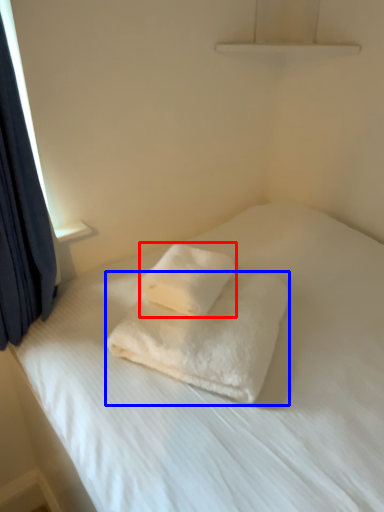
Question: Which point is further to the camera, towel (highlighted by a red box) or towel (highlighted by a blue box)?

Choices:
 (A) towel
 (B) towel

Answer: (A)